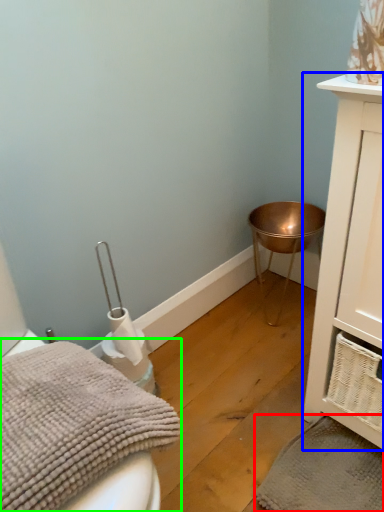
Question: Which object is positioned closest to bath towel (highlighted by a red box)? Select from bathroom cabinet (highlighted by a blue box) and bath towel (highlighted by a green box).

Choices:
 (A) bathroom cabinet
 (B) bath towel

Answer: (A)